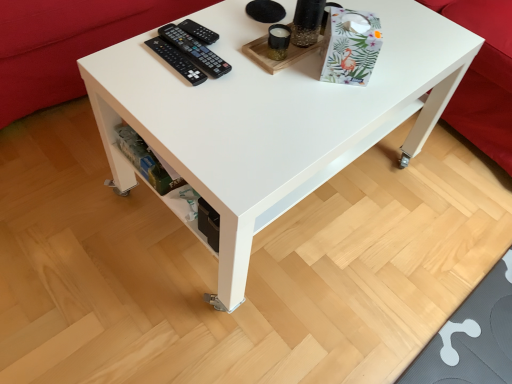
Question: Does black plastic remote at upper center, which ranks as the second control in bottom-to-top order, turn towards white glossy table at center?

Choices:
 (A) yes
 (B) no

Answer: (A)

Question: Is black plastic remote at upper center, positioned as the 1th control in top-to-bottom order, not inside white glossy table at center?

Choices:
 (A) no
 (B) yes

Answer: (A)

Question: Is black plastic remote at upper center, positioned as the 1th control in top-to-bottom order, positioned in front of white glossy table at center?

Choices:
 (A) no
 (B) yes

Answer: (A)

Question: Is black plastic remote at upper center, which ranks as the second control in bottom-to-top order, to the left of white glossy table at center from the viewer's perspective?

Choices:
 (A) yes
 (B) no

Answer: (A)

Question: Is white glossy table at center a part of black plastic remote at upper center, positioned as the 1th control in top-to-bottom order?

Choices:
 (A) no
 (B) yes

Answer: (A)

Question: Would you say black plastic remote controls at upper left, marked as the 1th control in a bottom-to-top arrangement, is to the left or to the right of red fabric couch at upper right, the 1th couch viewed from the right, in the picture?

Choices:
 (A) left
 (B) right

Answer: (A)

Question: Considering the positions of black plastic remote controls at upper left, marked as the 1th control in a bottom-to-top arrangement, and red fabric couch at upper right, the 1th couch viewed from the right, in the image, is black plastic remote controls at upper left, marked as the 1th control in a bottom-to-top arrangement, bigger or smaller than red fabric couch at upper right, the 1th couch viewed from the right,?

Choices:
 (A) small
 (B) big

Answer: (A)

Question: Is point (172, 26) positioned closer to the camera than point (484, 13)?

Choices:
 (A) farther
 (B) closer

Answer: (B)

Question: Considering the positions of black plastic remote controls at upper left, the second control in the top-to-bottom sequence, and red fabric couch at upper right, acting as the 2th couch starting from the left, in the image, is black plastic remote controls at upper left, the second control in the top-to-bottom sequence, taller or shorter than red fabric couch at upper right, acting as the 2th couch starting from the left,?

Choices:
 (A) short
 (B) tall

Answer: (A)

Question: Which is correct: white glossy table at center is inside red fabric couch at upper right, acting as the 2th couch starting from the left, or outside of it?

Choices:
 (A) outside
 (B) inside

Answer: (A)

Question: Does point (156, 120) appear closer or farther from the camera than point (480, 49)?

Choices:
 (A) closer
 (B) farther

Answer: (A)

Question: From a real-world perspective, is white glossy table at center physically located above or below red fabric couch at upper right, the 1th couch viewed from the right?

Choices:
 (A) below
 (B) above

Answer: (B)

Question: Visually, is white glossy table at center positioned to the left or to the right of red fabric couch at upper right, the 1th couch viewed from the right?

Choices:
 (A) left
 (B) right

Answer: (A)

Question: From a real-world perspective, relative to black plastic remote controls at upper left, marked as the 1th control in a bottom-to-top arrangement, is black plastic remote at upper center, positioned as the 1th control in top-to-bottom order, vertically above or below?

Choices:
 (A) below
 (B) above

Answer: (A)

Question: From the image's perspective, is black plastic remote at upper center, positioned as the 1th control in top-to-bottom order, located above or below black plastic remote controls at upper left, the second control in the top-to-bottom sequence?

Choices:
 (A) below
 (B) above

Answer: (B)